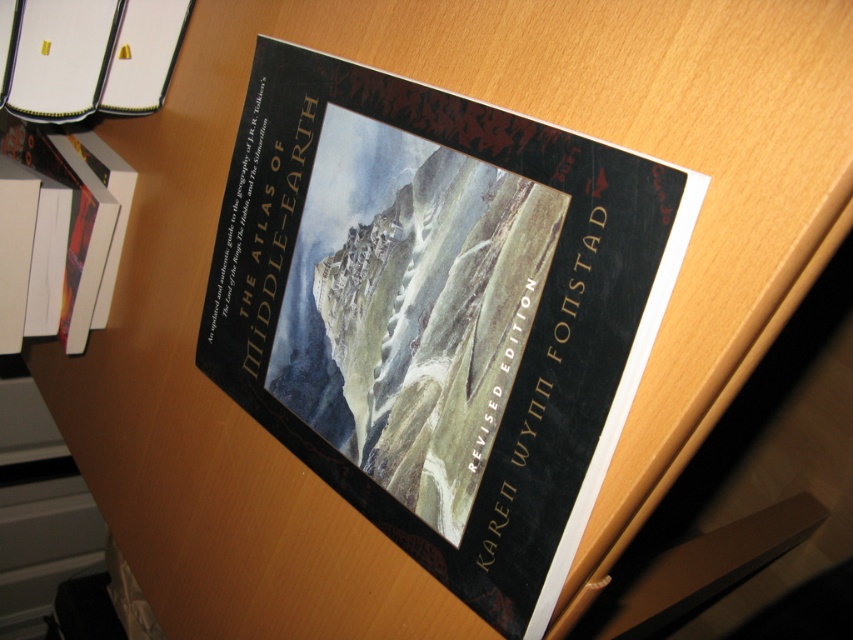
What are the coordinates of the hardcover book at center?

The hardcover book at center is located at coordinates point (439,312).

You are organizing a library shelf and notice the hardcover book at upper left and the white paper at left. Which item is placed above the other?

The hardcover book at upper left is positioned over white paper at left, so it is placed above the white paper at left.

You are organizing a bookshelf and need to place the hardcover book at upper left and the white paper at left. Given their sizes, which one should you place first to maximize space efficiency?

The hardcover book at upper left has a smaller size compared to the white paper at left. To maximize space efficiency, place the smaller hardcover book at upper left first, then the larger white paper at left.